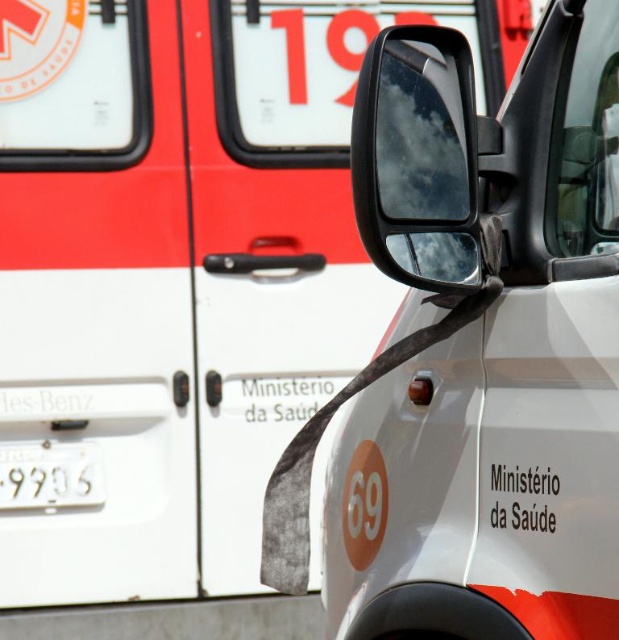
Does glossy plastic rearview mirror at upper center have a lesser width compared to white metallic license plate at lower left?

Yes, glossy plastic rearview mirror at upper center is thinner than white metallic license plate at lower left.

At what (x,y) coordinates should I click in order to perform the action: click on glossy plastic rearview mirror at upper center. Please return your answer as a coordinate pair (x, y). Image resolution: width=619 pixels, height=640 pixels. Looking at the image, I should click on (417, 157).

Does point (444, 250) come closer to viewer compared to point (58, 484)?

Yes.

The image size is (619, 640). I want to click on glossy plastic rearview mirror at upper center, so click(x=417, y=157).

Is white matte car at center positioned in front of glossy plastic rearview mirror at upper center?

Yes.

Is white matte car at center above glossy plastic rearview mirror at upper center?

Actually, white matte car at center is below glossy plastic rearview mirror at upper center.

What do you see at coordinates (477, 352) in the screenshot? This screenshot has height=640, width=619. I see `white matte car at center` at bounding box center [477, 352].

Find the location of a particular element. white matte car at center is located at coordinates (477, 352).

Between white matte car at center and white metallic license plate at lower left, which one appears on the right side from the viewer's perspective?

Positioned to the right is white matte car at center.

Is point (461, 333) positioned behind point (92, 483)?

That is False.

This screenshot has width=619, height=640. I want to click on white matte car at center, so click(477, 352).